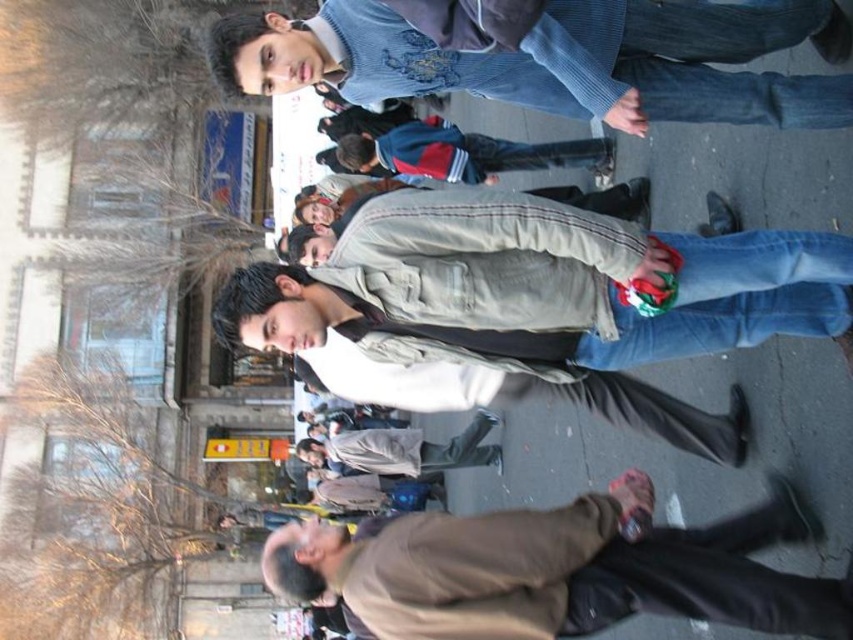
Question: In this image, where is brown matte jacket at lower right located relative to light brown leather jacket at center?

Choices:
 (A) right
 (B) left

Answer: (A)

Question: Estimate the real-world distances between objects in this image. Which object is farther from the light brown leather jacket at center?

Choices:
 (A) dark blue jacket at center
 (B) brown matte jacket at lower right
 (C) light blue knitted sweater at upper center
 (D) denim jeans at center

Answer: (C)

Question: Which object is the farthest from the denim jeans at center?

Choices:
 (A) dark blue jacket at center
 (B) light brown leather jacket at center
 (C) brown matte jacket at lower right

Answer: (B)

Question: Is the position of denim jeans at center less distant than that of light brown leather jacket at center?

Choices:
 (A) no
 (B) yes

Answer: (B)

Question: Which point is closer to the camera taking this photo?

Choices:
 (A) (753, 564)
 (B) (705, 298)
 (C) (431, 154)

Answer: (A)

Question: Is light blue knitted sweater at upper center smaller than brown matte jacket at lower right?

Choices:
 (A) no
 (B) yes

Answer: (A)